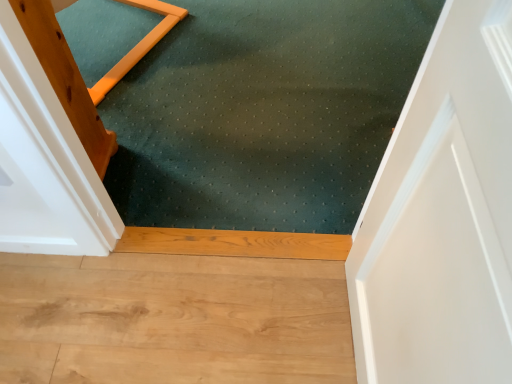
The width and height of the screenshot is (512, 384). Find the location of `free spot above light brown wood flooring at lower center (from a real-world perspective)`. free spot above light brown wood flooring at lower center (from a real-world perspective) is located at coordinates (177, 298).